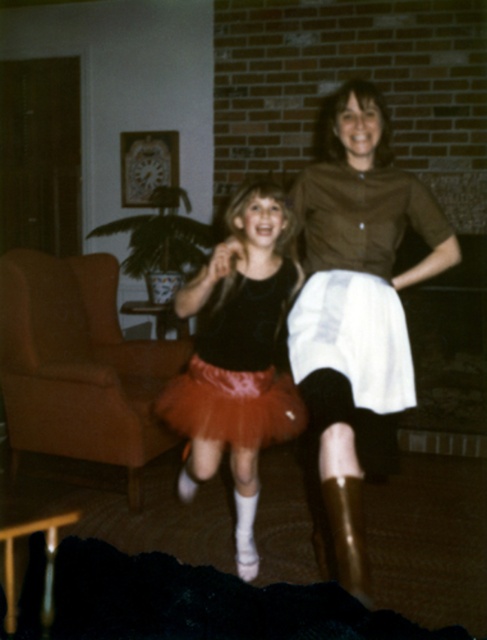
Who is more forward, (117, 337) or (238, 524)?

Positioned in front is point (238, 524).

Locate an element on the screen. brown leather armchair at left is located at coordinates (78, 364).

Which of these two, matte orange tutu skirt at center or matte pink tulle skirt at center, stands shorter?

matte pink tulle skirt at center is shorter.

Based on the photo, who is positioned more to the left, matte orange tutu skirt at center or matte pink tulle skirt at center?

matte orange tutu skirt at center is more to the left.

Locate an element on the screen. matte orange tutu skirt at center is located at coordinates (238, 356).

Can you confirm if brown matte skirt at center is shorter than brown leather armchair at left?

Incorrect, brown matte skirt at center's height does not fall short of brown leather armchair at left's.

Who is more forward, (355, 570) or (21, 301)?

Point (355, 570) is in front.

Where is `brown matte skirt at center`? The image size is (487, 640). brown matte skirt at center is located at coordinates (357, 310).